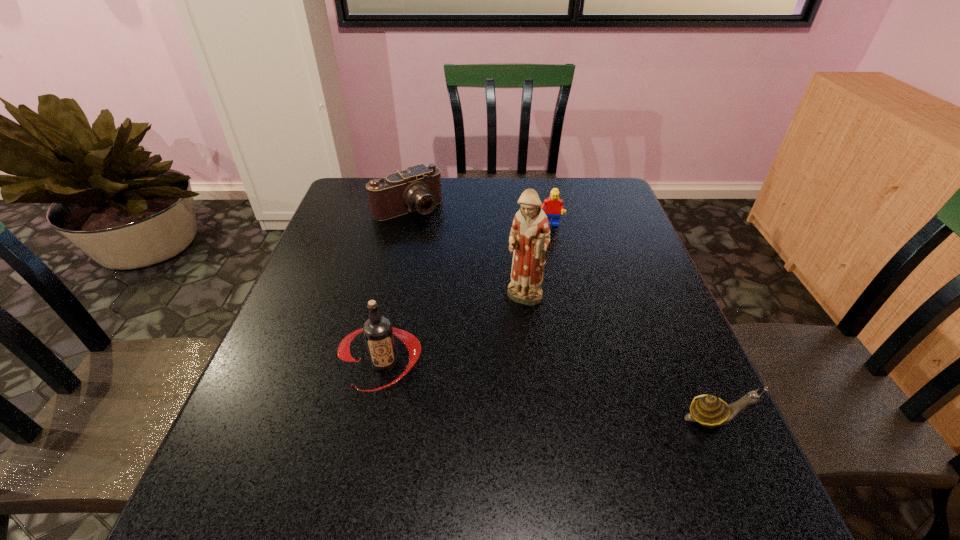
I want to click on blank space located 0.260m on the front-facing side of the camera, so click(464, 269).

The image size is (960, 540). In order to click on vacant area situated 0.400m on the front-facing side of the camera in this screenshot , I will do `click(492, 301)`.

Where is `free point located 0.290m on the front-facing side of the Lego`? free point located 0.290m on the front-facing side of the Lego is located at coordinates (557, 296).

The height and width of the screenshot is (540, 960). What are the coordinates of `free space located 0.390m on the front-facing side of the Lego` in the screenshot? It's located at point(561,327).

The image size is (960, 540). What are the coordinates of `free space located on the front-facing side of the Lego` in the screenshot? It's located at coord(560,323).

Find the location of a particular element. This screenshot has width=960, height=540. vacant point located on the front-facing side of the third nearest object is located at coordinates (493, 434).

Find the location of a particular element. The image size is (960, 540). vacant space located on the front-facing side of the third nearest object is located at coordinates (515, 348).

The image size is (960, 540). In order to click on free spot located on the front-facing side of the third nearest object in this screenshot , I will do `click(500, 406)`.

Find the location of `object located at the far edge`. object located at the far edge is located at coordinates (418, 188).

Where is `object located in the near edge section of the desktop`? The width and height of the screenshot is (960, 540). object located in the near edge section of the desktop is located at coordinates (710, 411).